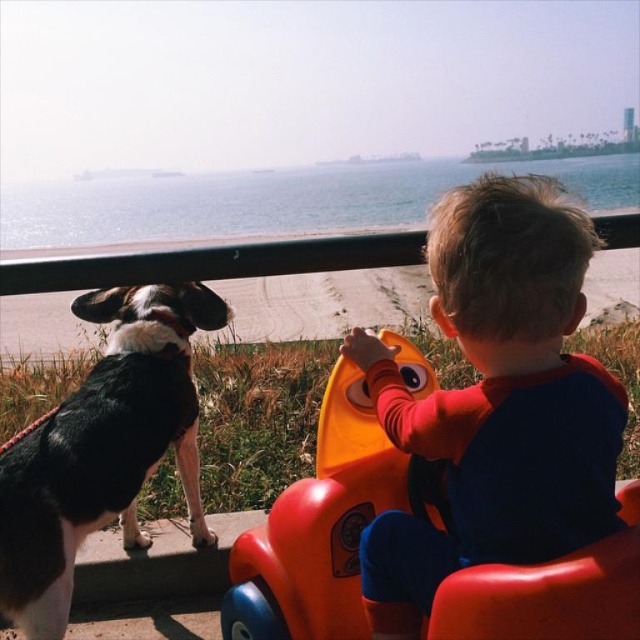
You are a parent trying to decide whether to let your child stand up in the smooth orange plastic toy car at center without assistance. Based on the height difference between the toy car and the black and white fur dog at left, do you think it is safe for the child to stand up in the toy car?

The smooth orange plastic toy car at center is shorter than the black and white fur dog at left. Since the toy car is lower in height, it might be safer for the child to stand up in it as there is less risk of a fall compared to a taller object like the dog. However, always ensure proper supervision.

What is the object located at the coordinates point (497, 401) in the image?

The object located at point (497, 401) is the smooth orange plastic toy car at center.